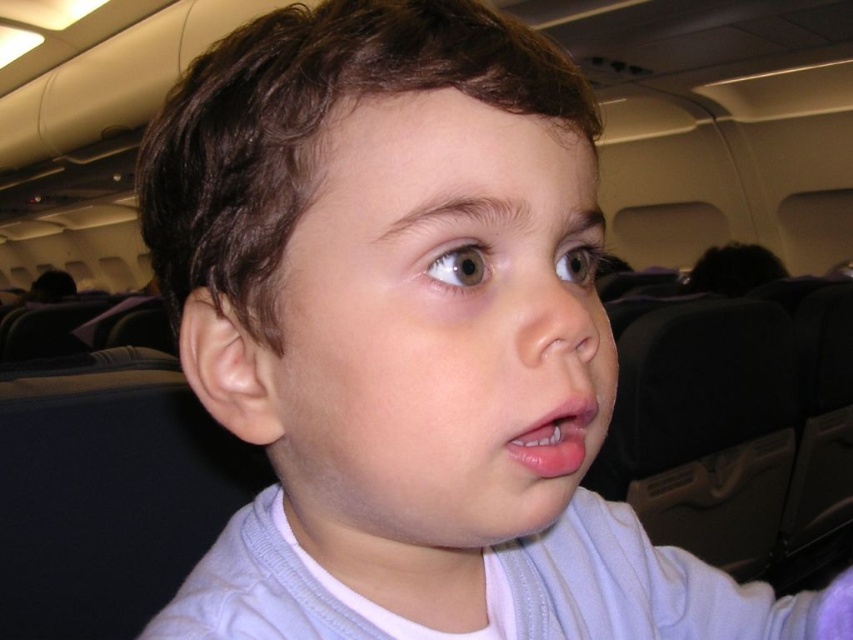
Question: Does smooth skin nose at center have a greater width compared to pink glossy lips at center?

Choices:
 (A) yes
 (B) no

Answer: (A)

Question: Is smooth skin nose at center to the left of pink glossy lips at center from the viewer's perspective?

Choices:
 (A) yes
 (B) no

Answer: (B)

Question: Can you confirm if smooth skin nose at center is positioned above pink glossy lips at center?

Choices:
 (A) yes
 (B) no

Answer: (A)

Question: Which object appears farthest from the camera in this image?

Choices:
 (A) smooth skin nose at center
 (B) pink glossy lips at center

Answer: (B)